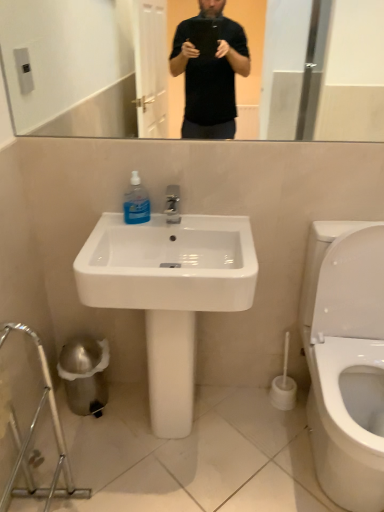
The image size is (384, 512). What are the coordinates of `white plastic toilet brush at lower right` in the screenshot? It's located at (283, 385).

What is the approximate width of white glossy sink at center?

It is 17.06 inches.

Where is `blue translucent liquid at sink`? Image resolution: width=384 pixels, height=512 pixels. blue translucent liquid at sink is located at coordinates (136, 202).

How many degrees apart are the facing directions of white plastic toilet brush at lower right and blue translucent liquid at sink?

The angular difference between white plastic toilet brush at lower right and blue translucent liquid at sink is 1.24 degrees.

Between white plastic toilet brush at lower right and blue translucent liquid at sink, which one has larger size?

white plastic toilet brush at lower right is bigger.

In the scene shown: Does white plastic toilet brush at lower right come in front of blue translucent liquid at sink?

No, white plastic toilet brush at lower right is further to the viewer.

Could you tell me if white plastic toilet brush at lower right is facing blue translucent liquid at sink?

No.

Which object is thinner, white glossy sink at center or white plastic toilet brush at lower right?

white plastic toilet brush at lower right is thinner.

Who is shorter, white glossy sink at center or white plastic toilet brush at lower right?

white plastic toilet brush at lower right is shorter.

From the image's perspective, is white glossy sink at center on top of white plastic toilet brush at lower right?

Indeed, from the image's perspective, white glossy sink at center is shown above white plastic toilet brush at lower right.

Is point (74, 262) closer to camera compared to point (283, 400)?

Yes.

In the scene shown: Is blue translucent liquid at sink in front of or behind white plastic toilet brush at lower right in the image?

In the image, blue translucent liquid at sink appears in front of white plastic toilet brush at lower right.

From a real-world perspective, is blue translucent liquid at sink physically below white plastic toilet brush at lower right?

No.

How distant is blue translucent liquid at sink from white plastic toilet brush at lower right?

blue translucent liquid at sink is 34.77 inches away from white plastic toilet brush at lower right.

Where is `brush below the blue translucent liquid at sink (from a real-world perspective)`? Image resolution: width=384 pixels, height=512 pixels. brush below the blue translucent liquid at sink (from a real-world perspective) is located at coordinates (283, 385).

Between white plastic toilet brush at lower right and white glossy sink at center, which one has smaller size?

white plastic toilet brush at lower right is smaller.

Are white plastic toilet brush at lower right and white glossy sink at center beside each other?

No, white plastic toilet brush at lower right is not beside white glossy sink at center.

In the image, there is a white glossy sink at center. Identify the location of brush below it (from the image's perspective). (283, 385).

From the picture: From a real-world perspective, between white plastic toilet brush at lower right and white glossy sink at center, who is vertically lower?

white plastic toilet brush at lower right is physically lower.

Can you tell me how much blue translucent liquid at sink and white glossy sink at center differ in facing direction?

They differ by 1.21 degrees in their facing directions.

Consider the image. From a real-world perspective, relative to white glossy sink at center, is blue translucent liquid at sink vertically above or below?

Clearly, from a real-world perspective, blue translucent liquid at sink is above white glossy sink at center.

Between blue translucent liquid at sink and white glossy sink at center, which one has less height?

With less height is blue translucent liquid at sink.

Is blue translucent liquid at sink further to the viewer compared to white glossy sink at center?

Yes, blue translucent liquid at sink is further from the camera.

Is point (123, 285) closer to viewer compared to point (131, 201)?

Yes, point (123, 285) is closer to viewer.

Considering the sizes of white glossy sink at center and blue translucent liquid at sink in the image, is white glossy sink at center wider or thinner than blue translucent liquid at sink?

Clearly, white glossy sink at center has more width compared to blue translucent liquid at sink.

Considering the relative positions of white glossy sink at center and blue translucent liquid at sink in the image provided, is white glossy sink at center to the left or to the right of blue translucent liquid at sink?

Based on their positions, white glossy sink at center is located to the right of blue translucent liquid at sink.

Which is behind, white glossy sink at center or blue translucent liquid at sink?

blue translucent liquid at sink is further away from the camera.

Find the location of a particular element. This screenshot has width=384, height=512. brush to the right of blue translucent liquid at sink is located at coordinates (283, 385).

What are the coordinates of `sink to the left of white plastic toilet brush at lower right` in the screenshot? It's located at (169, 293).

When comparing their distances from white plastic toilet brush at lower right, does white glossy sink at center or blue translucent liquid at sink seem further?

blue translucent liquid at sink is positioned further to the anchor white plastic toilet brush at lower right.

From the image, which object appears to be nearer to white plastic toilet brush at lower right, blue translucent liquid at sink or white glossy sink at center?

white glossy sink at center lies closer to white plastic toilet brush at lower right than the other object.

From the image, which object appears to be nearer to white glossy sink at center, white plastic toilet brush at lower right or blue translucent liquid at sink?

blue translucent liquid at sink is closer to white glossy sink at center.

Based on their spatial positions, is blue translucent liquid at sink or white plastic toilet brush at lower right further from white glossy sink at center?

Based on the image, white plastic toilet brush at lower right appears to be further to white glossy sink at center.

Estimate the real-world distances between objects in this image. Which object is closer to blue translucent liquid at sink, white glossy sink at center or white plastic toilet brush at lower right?

white glossy sink at center is positioned closer to the anchor blue translucent liquid at sink.

Which object lies nearer to the anchor point blue translucent liquid at sink, white plastic toilet brush at lower right or white glossy sink at center?

white glossy sink at center is positioned closer to the anchor blue translucent liquid at sink.

This screenshot has height=512, width=384. Find the location of `sink between blue translucent liquid at sink and white plastic toilet brush at lower right vertically`. sink between blue translucent liquid at sink and white plastic toilet brush at lower right vertically is located at coordinates (169, 293).